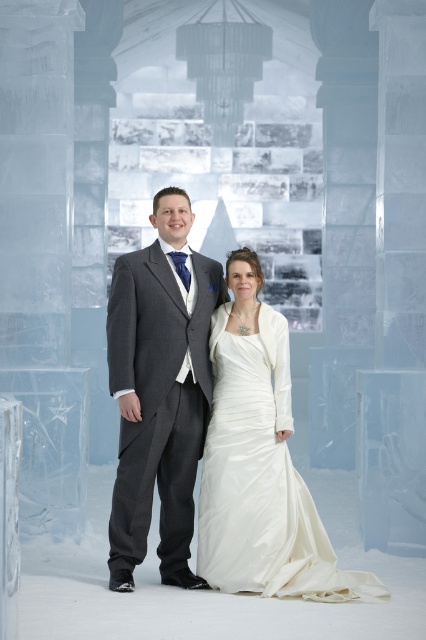
What do you see at coordinates (160, 390) in the screenshot? The width and height of the screenshot is (426, 640). I see `charcoal gray suit at center` at bounding box center [160, 390].

In the scene shown: Does charcoal gray suit at center appear on the left side of satin white dress at center?

Correct, you'll find charcoal gray suit at center to the left of satin white dress at center.

Who is more forward, (189, 419) or (238, 589)?

Point (238, 589) is in front.

Identify the location of charcoal gray suit at center. The height and width of the screenshot is (640, 426). (160, 390).

Is white satin dress at center taller than charcoal gray suit at center?

Incorrect, white satin dress at center's height is not larger of charcoal gray suit at center's.

Consider the image. Does white satin dress at center have a smaller size compared to charcoal gray suit at center?

No, white satin dress at center is not smaller than charcoal gray suit at center.

Identify the location of white satin dress at center. The height and width of the screenshot is (640, 426). (259, 461).

Which of these two, white satin dress at center or satin white dress at center, stands shorter?

With less height is satin white dress at center.

Is white satin dress at center above satin white dress at center?

Indeed, white satin dress at center is positioned over satin white dress at center.

Which is behind, point (259, 344) or point (284, 512)?

Positioned behind is point (259, 344).

You are a GUI agent. You are given a task and a screenshot of the screen. Output one action in this format:
    pyautogui.click(x=<x>, y=<y>)
    Task: Click on the white satin dress at center
    This screenshot has width=426, height=640.
    Given the screenshot: What is the action you would take?
    pyautogui.click(x=259, y=461)